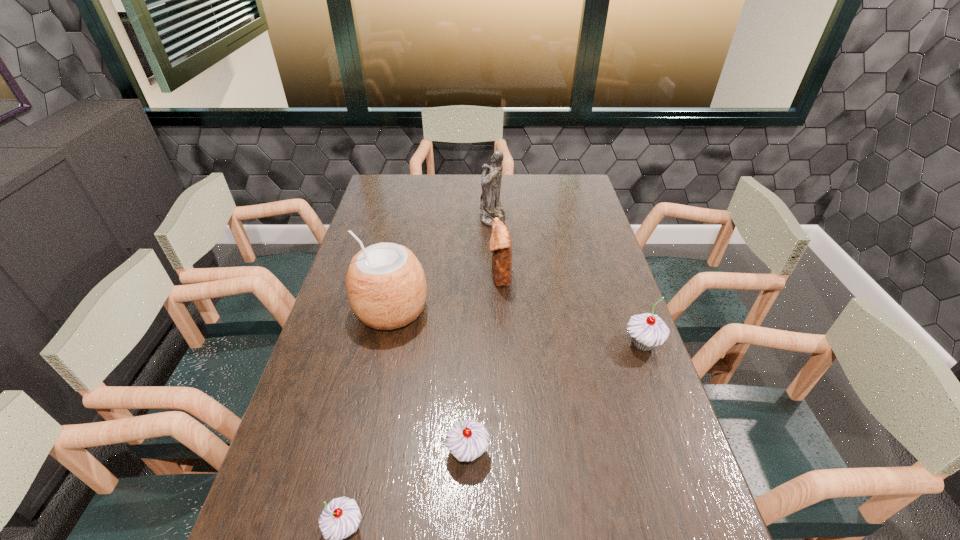
Identify the location of vacant space situated on the open side of the clutch bag. Image resolution: width=960 pixels, height=540 pixels. (412, 275).

You are a GUI agent. You are given a task and a screenshot of the screen. Output one action in this format:
    pyautogui.click(x=<x>, y=<y>)
    Task: Click on the free point located 0.180m on the open side of the clutch bag
    This screenshot has width=960, height=540.
    Given the screenshot: What is the action you would take?
    pyautogui.click(x=435, y=275)

I want to click on vacant region located on the front-facing side of the figurine, so click(x=460, y=217).

You are a GUI agent. You are given a task and a screenshot of the screen. Output one action in this format:
    pyautogui.click(x=<x>, y=<y>)
    Task: Click on the free space located on the front-facing side of the figurine
    The height and width of the screenshot is (540, 960).
    Given the screenshot: What is the action you would take?
    point(384,217)

Identify the location of blank area located 0.390m on the front-facing side of the figurine. (382, 217).

The image size is (960, 540). I want to click on blank space located on the left of the coconut, so click(328, 310).

In order to click on object positioned at the left edge in this screenshot , I will do `click(386, 285)`.

You are a GUI agent. You are given a task and a screenshot of the screen. Output one action in this format:
    pyautogui.click(x=<x>, y=<y>)
    Task: Click on the object present at the right edge
    The height and width of the screenshot is (540, 960).
    Given the screenshot: What is the action you would take?
    pyautogui.click(x=647, y=330)

In the image, there is a desktop. What are the coordinates of `vacant area at the far edge` in the screenshot? It's located at [x=462, y=192].

The width and height of the screenshot is (960, 540). Identify the location of free space at the left edge. (363, 226).